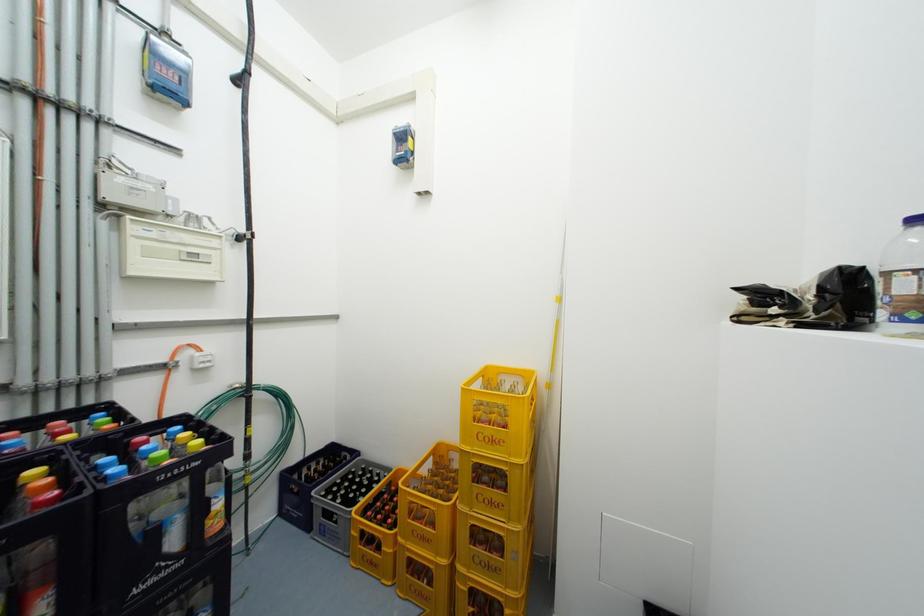
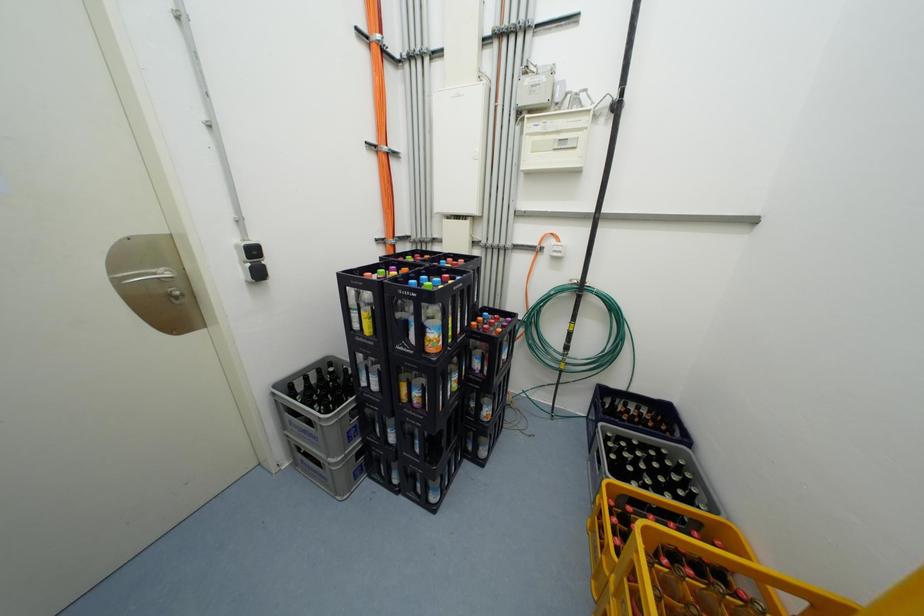
Based on the continuous images, in which direction is the camera rotating?

The rotation direction of the camera is left-down.